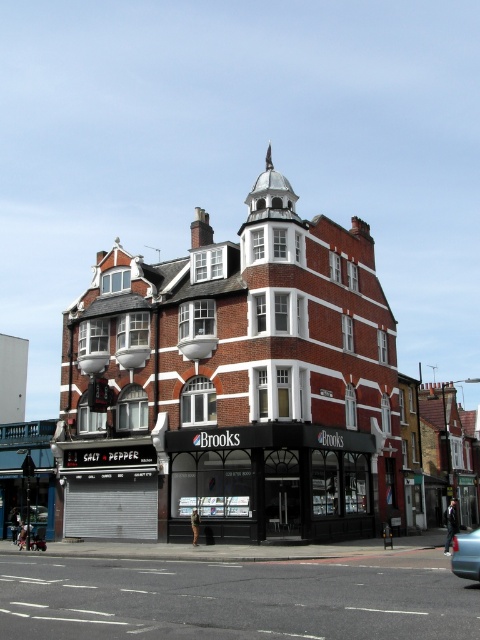
Question: Considering the real-world distances, which object is farthest from the black asphalt road at lower center?

Choices:
 (A) metallic blue sedan at lower right
 (B) matte black storefront at center
 (C) red brick building at center

Answer: (C)

Question: Can you confirm if red brick building at center is positioned to the left of black asphalt road at lower center?

Choices:
 (A) no
 (B) yes

Answer: (B)

Question: Does black asphalt road at lower center have a lesser width compared to metallic blue sedan at lower right?

Choices:
 (A) no
 (B) yes

Answer: (A)

Question: Which of these objects is positioned farthest from the matte black storefront at center?

Choices:
 (A) black asphalt road at lower center
 (B) metallic blue sedan at lower right

Answer: (B)

Question: In this image, where is black asphalt road at lower center located relative to metallic blue sedan at lower right?

Choices:
 (A) left
 (B) right

Answer: (A)

Question: Which of the following is the farthest from the observer?

Choices:
 (A) matte black storefront at center
 (B) metallic blue sedan at lower right

Answer: (A)